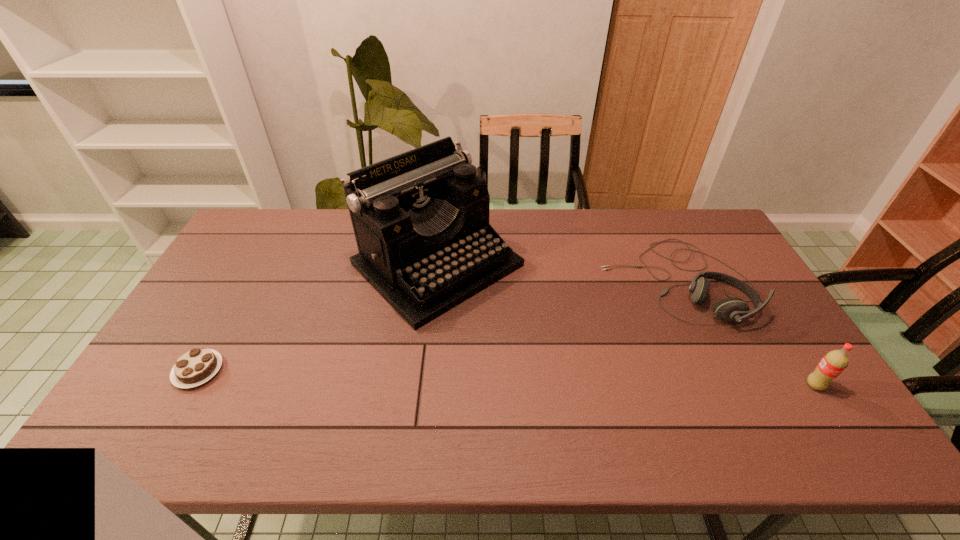
This screenshot has height=540, width=960. In order to click on the shortest object in this screenshot , I will do `click(197, 366)`.

In order to click on the leftmost object in this screenshot , I will do `click(197, 366)`.

Image resolution: width=960 pixels, height=540 pixels. In order to click on the third shortest object in this screenshot , I will do `click(834, 362)`.

The width and height of the screenshot is (960, 540). I want to click on the third tallest object, so click(728, 309).

The height and width of the screenshot is (540, 960). I want to click on the third object from right to left, so click(421, 218).

Locate an element on the screen. This screenshot has width=960, height=540. typewriter is located at coordinates (421, 218).

Where is `vacant space located on the back of the chocolate cake`? vacant space located on the back of the chocolate cake is located at coordinates (230, 313).

The height and width of the screenshot is (540, 960). What are the coordinates of `free location located on the left of the soda` in the screenshot? It's located at (663, 385).

The height and width of the screenshot is (540, 960). I want to click on vacant region located on the outer surface of the third tallest object, so click(597, 329).

The image size is (960, 540). In order to click on free space located on the outer surface of the third tallest object in this screenshot , I will do `click(614, 319)`.